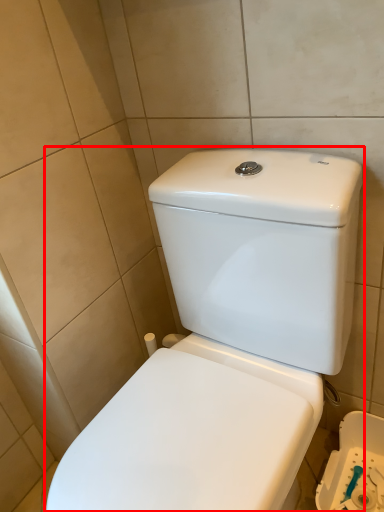
Question: In this image, where is toilet (annotated by the red box) located relative to porcelain?

Choices:
 (A) right
 (B) left

Answer: (B)